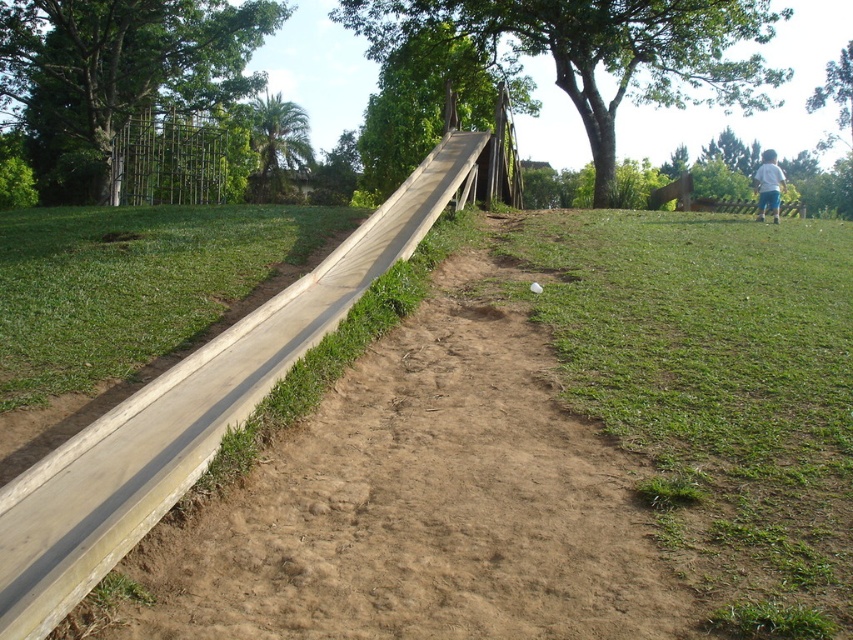
Question: Which point is closer to the camera?

Choices:
 (A) (566, 314)
 (B) (136, 490)

Answer: (B)

Question: Is green leafy tree at upper left above white cotton shirt at upper right?

Choices:
 (A) yes
 (B) no

Answer: (A)

Question: Estimate the real-world distances between objects in this image. Which object is farther from the white cotton shirt at upper right?

Choices:
 (A) green leafy tree at upper left
 (B) wooden ramp at center
 (C) green wood tree at upper center
 (D) green leafy palm at upper left

Answer: (A)

Question: Does green leafy tree at upper left have a smaller size compared to green wood tree at upper center?

Choices:
 (A) no
 (B) yes

Answer: (B)

Question: Which point is closer to the camera?

Choices:
 (A) green leafy palm at upper left
 (B) white cotton shirt at upper right

Answer: (B)

Question: Is green grass at lower right thinner than green leafy tree at upper left?

Choices:
 (A) yes
 (B) no

Answer: (A)